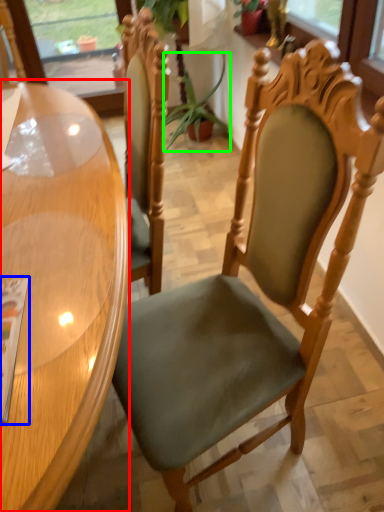
Question: Estimate the real-world distances between objects in this image. Which object is farther from table (highlighted by a red box), magazine (highlighted by a blue box) or plant (highlighted by a green box)?

Choices:
 (A) magazine
 (B) plant

Answer: (B)